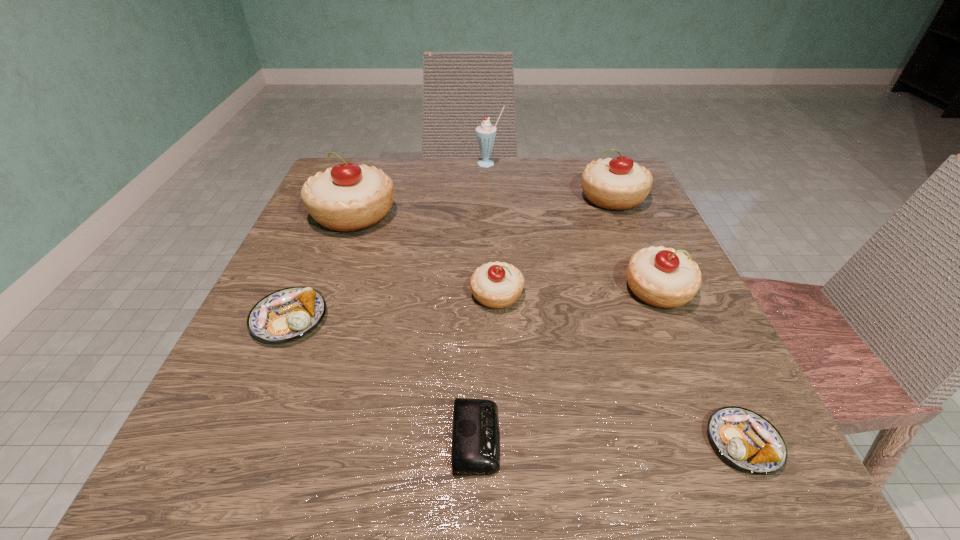
Identify the location of milkshake. (485, 133).

Locate an element on the screen. Image resolution: width=960 pixels, height=540 pixels. white milkshake is located at coordinates (485, 133).

Find the location of a particular element. the leftmost beige pastry is located at coordinates (x=348, y=197).

Find the location of a particular element. the tallest pastry is located at coordinates (348, 197).

In order to click on the second tallest pastry in this screenshot , I will do `click(619, 183)`.

You are a GUI agent. You are given a task and a screenshot of the screen. Output one action in this format:
    pyautogui.click(x=<x>, y=<y>)
    Task: Click on the sixth shortest object
    
    Given the screenshot: What is the action you would take?
    pyautogui.click(x=619, y=183)

The width and height of the screenshot is (960, 540). Identify the location of the third biggest beige pastry. (662, 277).

At what (x,y) coordinates should I click in order to perform the action: click on the fourth tallest object. Please return your answer as a coordinate pair (x, y). The width and height of the screenshot is (960, 540). Looking at the image, I should click on (662, 277).

Where is `the third pastry from left to right`? The width and height of the screenshot is (960, 540). the third pastry from left to right is located at coordinates (497, 285).

You are a GUI agent. You are given a task and a screenshot of the screen. Output one action in this format:
    pyautogui.click(x=<x>, y=<y>)
    Task: Click on the fourth shortest object
    This screenshot has width=960, height=540.
    Given the screenshot: What is the action you would take?
    pyautogui.click(x=497, y=285)